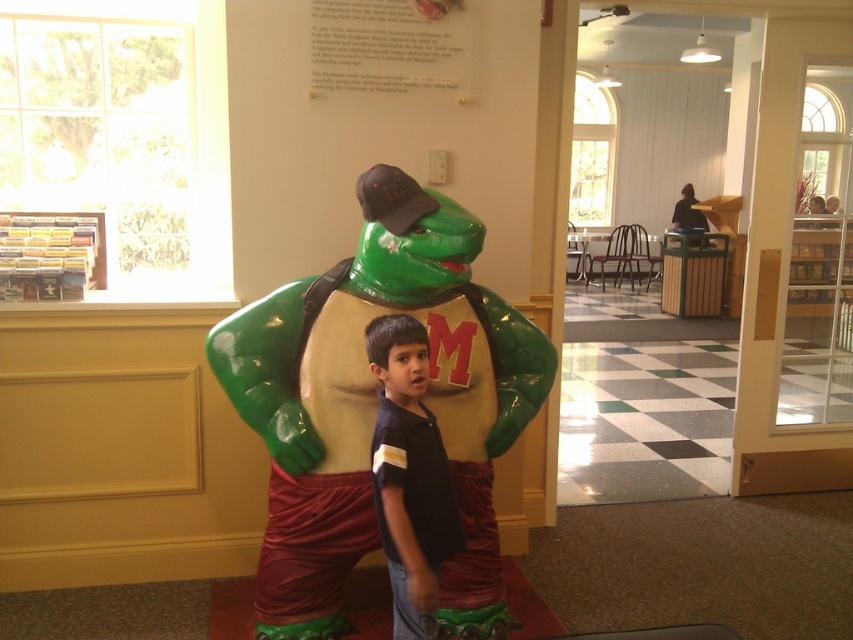
You are a photographer setting up for a group photo in this lobby. You need to position the glossy plastic turtle at center and the black cotton shirt at center so that both are clearly visible in the frame. Based on their current positions, which object is closer to the camera and should be prioritized in the composition?

The glossy plastic turtle at center is closer to the camera than the black cotton shirt at center, so it should be prioritized in the composition to ensure both are clearly visible.

You are a photographer setting up for an event. You need to position a camera so that both the glossy plastic turtle at center and the black cotton shirt at center are in focus. The camera has a depth of field that can cover objects within 10 inches. Will both objects be in focus?

The glossy plastic turtle at center and the black cotton shirt at center are 10.82 inches apart. Since the camera can only cover 10 inches, the distance between them exceeds the depth of field range. Therefore, both objects cannot be in focus simultaneously.